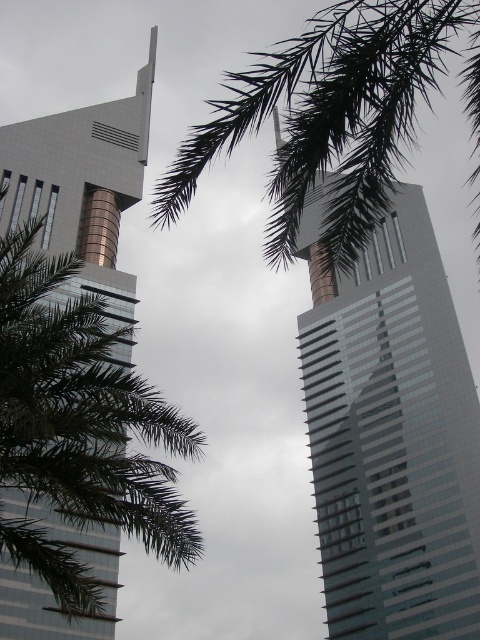
You are standing at point (391, 435) in the image. Looking around, you see the glassy reflective skyscraper at center. Which direction should you face to see the palm tree branches in the foreground?

The palm tree branches extend into the frame from the left side, so facing left from point (391, 435) will allow you to see the palm tree branches in the foreground.

You are standing at the base of the metallic glass skyscraper at left and want to walk towards the glassy reflective skyscraper at center. Which direction should you head?

You should head to the right because the glassy reflective skyscraper at center is to the right of the metallic glass skyscraper at left.

You are an architect analyzing the image. You need to determine if the glassy reflective skyscraper at center can fit within the space currently occupied by the green leafy palm at upper center. Based on their widths, can the skyscraper fit?

The glassy reflective skyscraper at center is narrower than the green leafy palm at upper center, so it can fit within the space occupied by the green leafy palm at upper center.